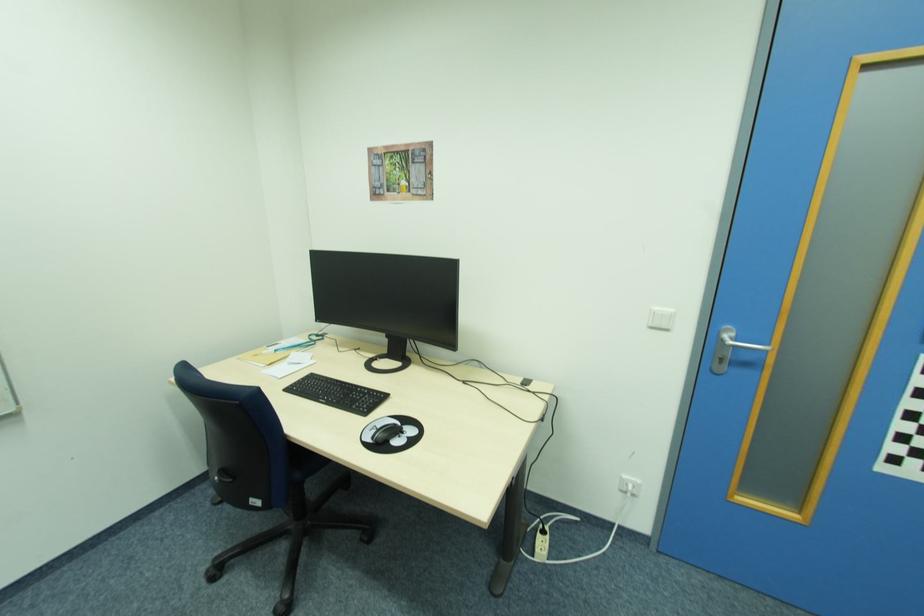
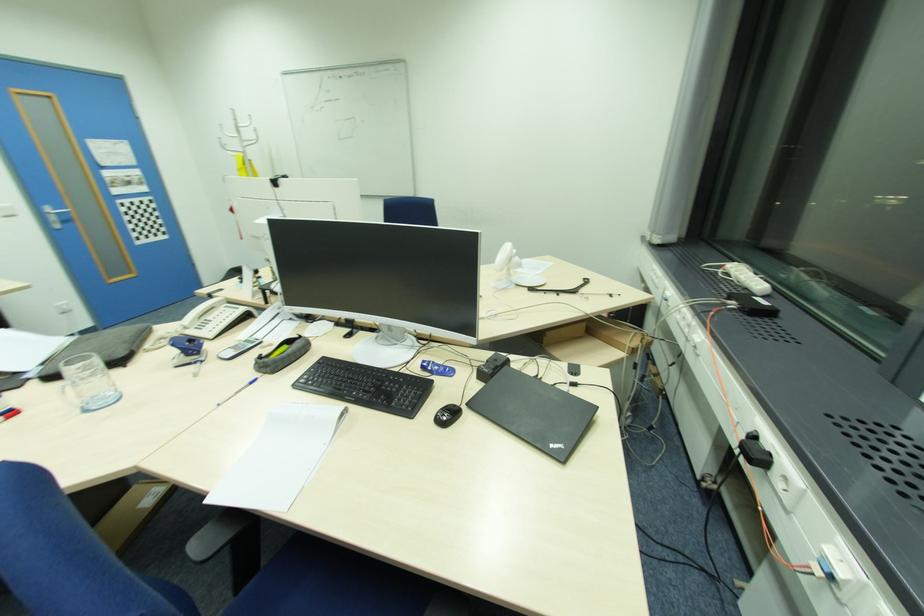
Find the pixel in the second image that matches (725,339) in the first image.

(54, 213)